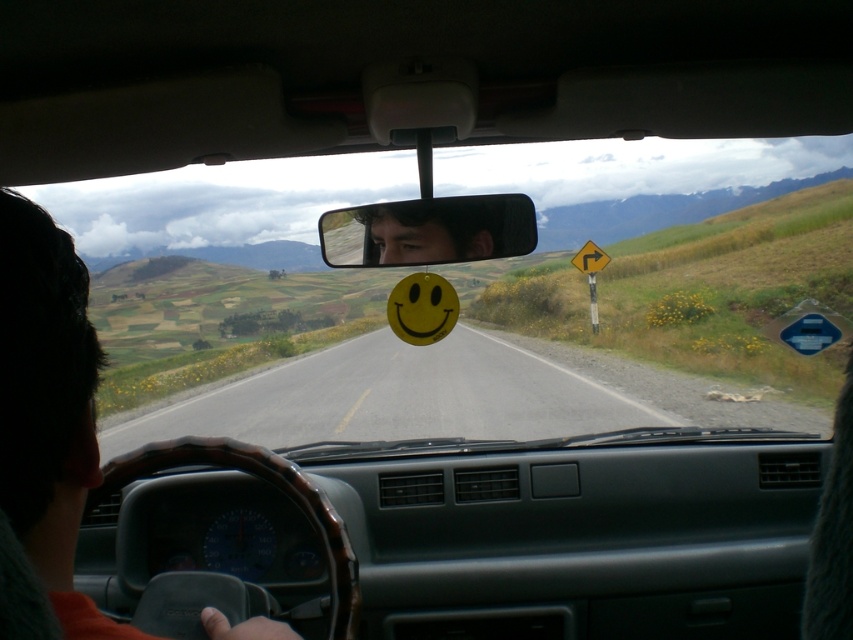
Is brown leather steering wheel at lower left below matte plastic mirror at center?

Correct, brown leather steering wheel at lower left is located below matte plastic mirror at center.

Which is more to the right, brown leather steering wheel at lower left or matte plastic mirror at center?

From the viewer's perspective, matte plastic mirror at center appears more on the right side.

Who is more distant from viewer, (44, 307) or (505, 221)?

Point (505, 221)

At what (x,y) coordinates should I click in order to perform the action: click on brown leather steering wheel at lower left. Please return your answer as a coordinate pair (x, y). The image size is (853, 640). Looking at the image, I should click on (48, 404).

Is brown leather steering wheel at lower left in front of smooth skin face at center?

That is True.

Is brown leather steering wheel at lower left thinner than smooth skin face at center?

Correct, brown leather steering wheel at lower left's width is less than smooth skin face at center's.

Identify the location of brown leather steering wheel at lower left. The image size is (853, 640). (48, 404).

You are a GUI agent. You are given a task and a screenshot of the screen. Output one action in this format:
    pyautogui.click(x=<x>, y=<y>)
    Task: Click on the brown leather steering wheel at lower left
    This screenshot has width=853, height=640.
    Given the screenshot: What is the action you would take?
    pyautogui.click(x=48, y=404)

Can you confirm if smooth asphalt road at center is positioned to the left of brown leather steering wheel at lower left?

Incorrect, smooth asphalt road at center is not on the left side of brown leather steering wheel at lower left.

This screenshot has height=640, width=853. In order to click on smooth asphalt road at center in this screenshot , I will do `click(402, 396)`.

Identify the location of smooth asphalt road at center. The image size is (853, 640). (402, 396).